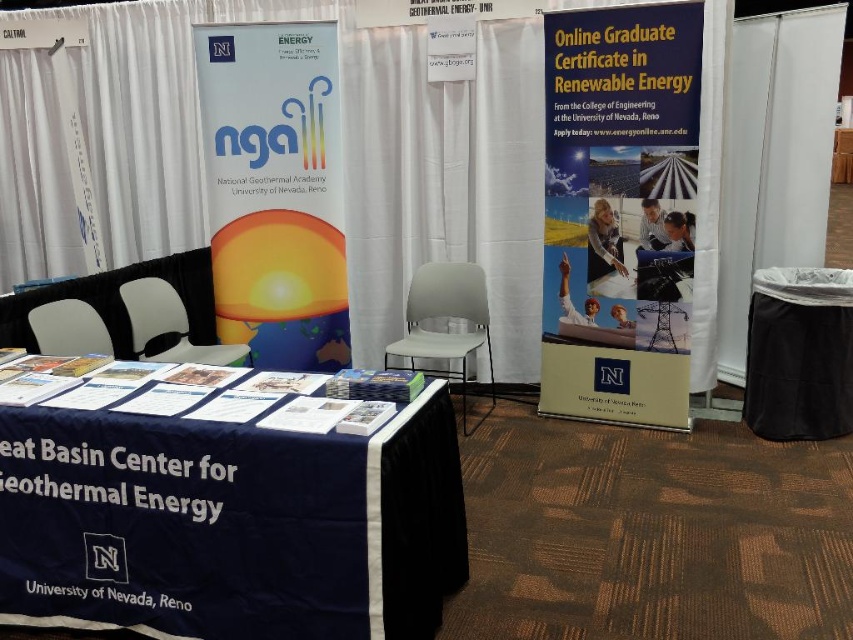
Can you confirm if blue fabric table at lower left is thinner than yellow matte sign at center?

No.

Describe the element at coordinates (225, 513) in the screenshot. I see `blue fabric table at lower left` at that location.

Describe the element at coordinates (225, 513) in the screenshot. I see `blue fabric table at lower left` at that location.

Find the location of a particular element. This screenshot has height=640, width=853. blue fabric table at lower left is located at coordinates (225, 513).